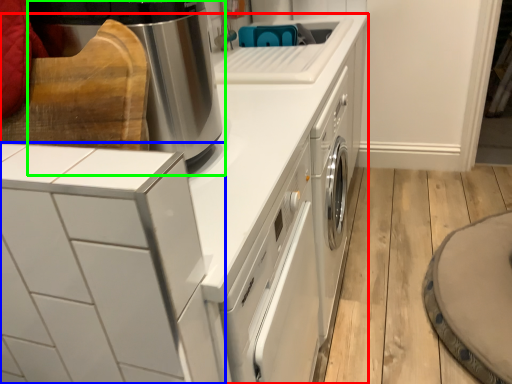
Question: Which is farther away from home appliance (highlighted by a red box)? home appliance (highlighted by a blue box) or home appliance (highlighted by a green box)?

Choices:
 (A) home appliance
 (B) home appliance

Answer: (B)